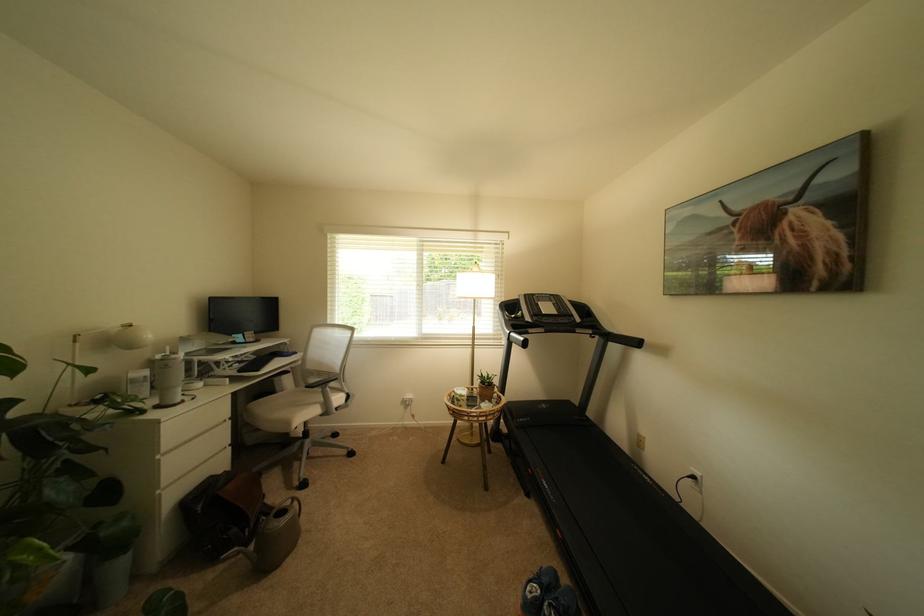
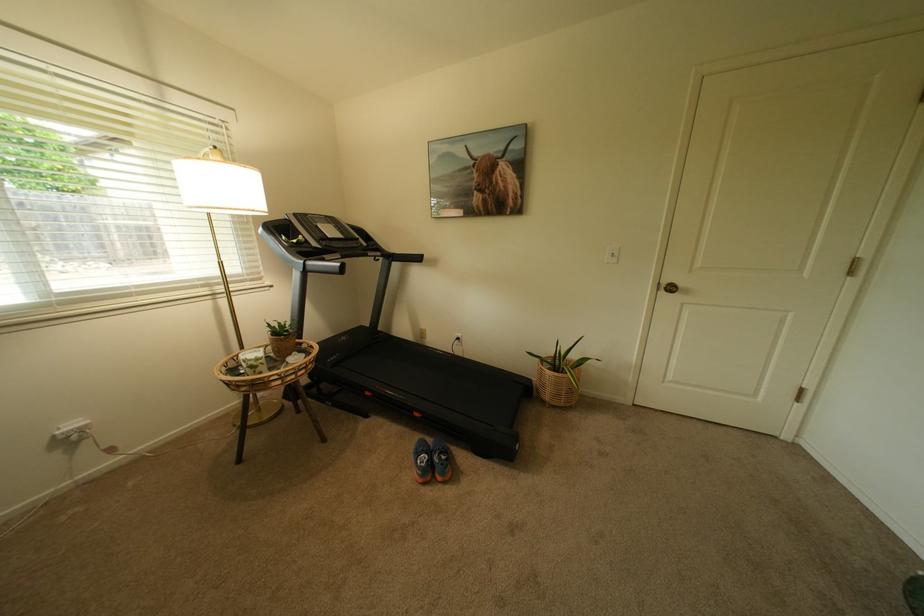
First-person continuous shooting, in which direction is the camera rotating?

The rotation direction of the camera is right-down.